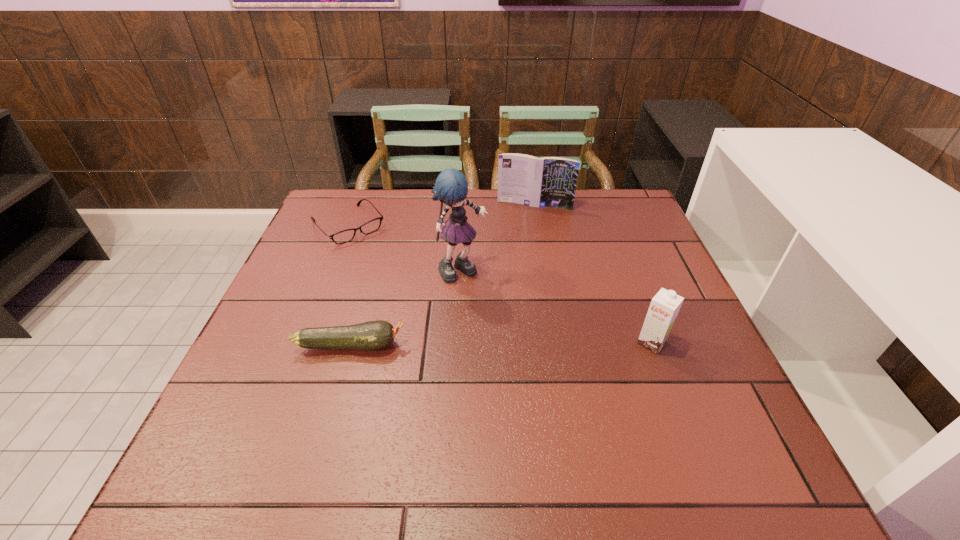
At what (x,y) coordinates should I click in order to perform the action: click on spectacles that is positioned at the left edge. Please return your answer as a coordinate pair (x, y). Looking at the image, I should click on pyautogui.click(x=373, y=225).

I want to click on object that is at the right edge, so click(x=664, y=307).

This screenshot has width=960, height=540. Identify the location of object present at the far left corner. (373, 225).

In the image, there is a desktop. Where is `free space at the far edge`? free space at the far edge is located at coordinates (552, 212).

In the image, there is a desktop. In order to click on vacant space at the near edge in this screenshot , I will do `click(537, 395)`.

Find the location of a particular element. vacant area at the left edge of the desktop is located at coordinates (313, 237).

Locate an element on the screen. free point at the right edge is located at coordinates (628, 255).

Where is `vacant area at the far left corner`? This screenshot has width=960, height=540. vacant area at the far left corner is located at coordinates (363, 217).

The height and width of the screenshot is (540, 960). Identify the location of vacant area between the third nearest object and the chocolate milk. (557, 307).

I want to click on vacant space in between the zucchini and the chocolate milk, so click(501, 344).